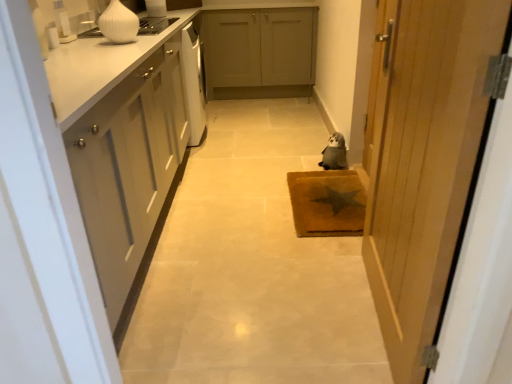
Question: Should I look upward or downward to see wooden door at right?

Choices:
 (A) down
 (B) up

Answer: (B)

Question: Does white glossy vase at upper left lie behind brown textured mat at center?

Choices:
 (A) no
 (B) yes

Answer: (A)

Question: Is brown textured mat at center surrounded by white glossy vase at upper left?

Choices:
 (A) yes
 (B) no

Answer: (B)

Question: Is white glossy vase at upper left far away from brown textured mat at center?

Choices:
 (A) yes
 (B) no

Answer: (A)

Question: Does white glossy vase at upper left come in front of brown textured mat at center?

Choices:
 (A) yes
 (B) no

Answer: (A)

Question: From the image's perspective, does white glossy vase at upper left appear higher than brown textured mat at center?

Choices:
 (A) yes
 (B) no

Answer: (A)

Question: Does white glossy vase at upper left have a lesser height compared to brown textured mat at center?

Choices:
 (A) no
 (B) yes

Answer: (A)

Question: Is white glossy vase at upper left taller than white matte cabinet at left, marked as the 1th cabinetry in a bottom-to-top arrangement?

Choices:
 (A) no
 (B) yes

Answer: (A)

Question: Can you confirm if white glossy vase at upper left is shorter than white matte cabinet at left, the 2th cabinetry viewed from the back?

Choices:
 (A) yes
 (B) no

Answer: (A)

Question: Could white matte cabinet at left, the 2th cabinetry when ordered from right to left, be considered to be inside white glossy vase at upper left?

Choices:
 (A) no
 (B) yes

Answer: (A)

Question: Considering the relative sizes of white glossy vase at upper left and white matte cabinet at left, acting as the 1th cabinetry starting from the left, in the image provided, is white glossy vase at upper left thinner than white matte cabinet at left, acting as the 1th cabinetry starting from the left,?

Choices:
 (A) yes
 (B) no

Answer: (A)

Question: Is white glossy vase at upper left completely or partially outside of white matte cabinet at left, the 1th cabinetry positioned from the front?

Choices:
 (A) yes
 (B) no

Answer: (A)

Question: Considering the relative positions of white glossy vase at upper left and white matte cabinet at left, marked as the 1th cabinetry in a bottom-to-top arrangement, in the image provided, is white glossy vase at upper left to the right of white matte cabinet at left, marked as the 1th cabinetry in a bottom-to-top arrangement, from the viewer's perspective?

Choices:
 (A) no
 (B) yes

Answer: (B)

Question: Are matte gray cabinets at center, which ranks as the second cabinetry in left-to-right order, and white matte cabinet at left, acting as the 1th cabinetry starting from the left, making contact?

Choices:
 (A) no
 (B) yes

Answer: (A)